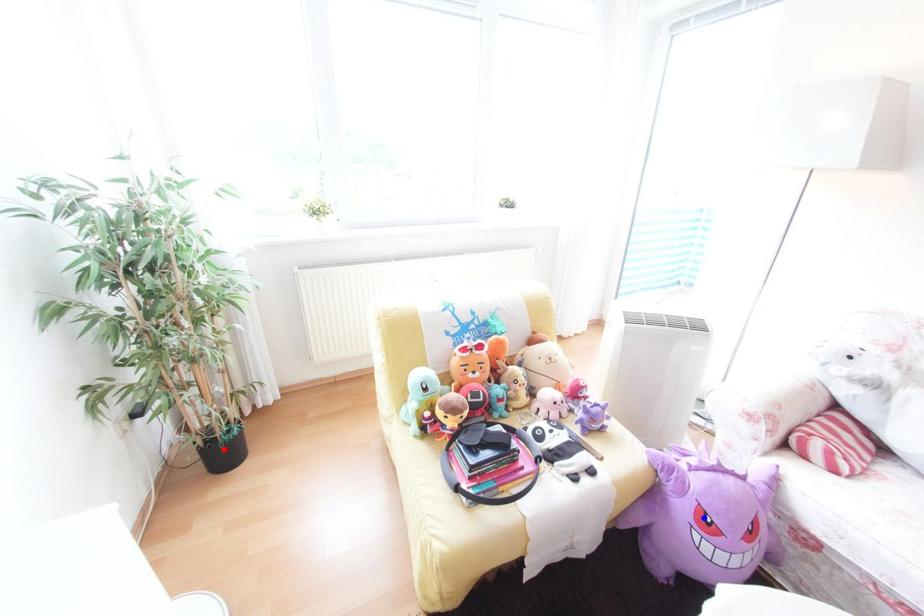
Question: Two points are marked on the image. Which point is closer to the camera?

Choices:
 (A) Blue point is closer.
 (B) Red point is closer.

Answer: (A)